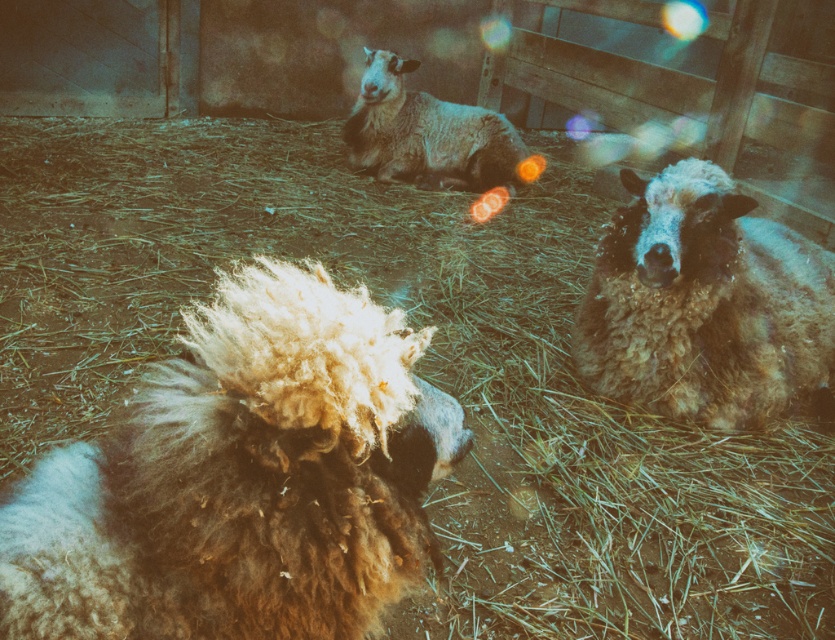
Question: Which object appears closest to the camera in this image?

Choices:
 (A) fluffy brown wool at center
 (B) fuzzy brown sheep at center
 (C) fuzzy woolen sheep at center

Answer: (A)

Question: Which of the following is the farthest from the observer?

Choices:
 (A) (464, 113)
 (B) (796, 317)

Answer: (A)

Question: Which object appears closest to the camera in this image?

Choices:
 (A) fluffy brown wool at center
 (B) fuzzy brown sheep at center

Answer: (A)

Question: Is fuzzy brown sheep at center in front of fuzzy woolen sheep at center?

Choices:
 (A) yes
 (B) no

Answer: (A)

Question: Can you confirm if fluffy brown wool at center is positioned above fuzzy woolen sheep at center?

Choices:
 (A) no
 (B) yes

Answer: (A)

Question: Can you confirm if fluffy brown wool at center is positioned above fuzzy woolen sheep at center?

Choices:
 (A) no
 (B) yes

Answer: (A)